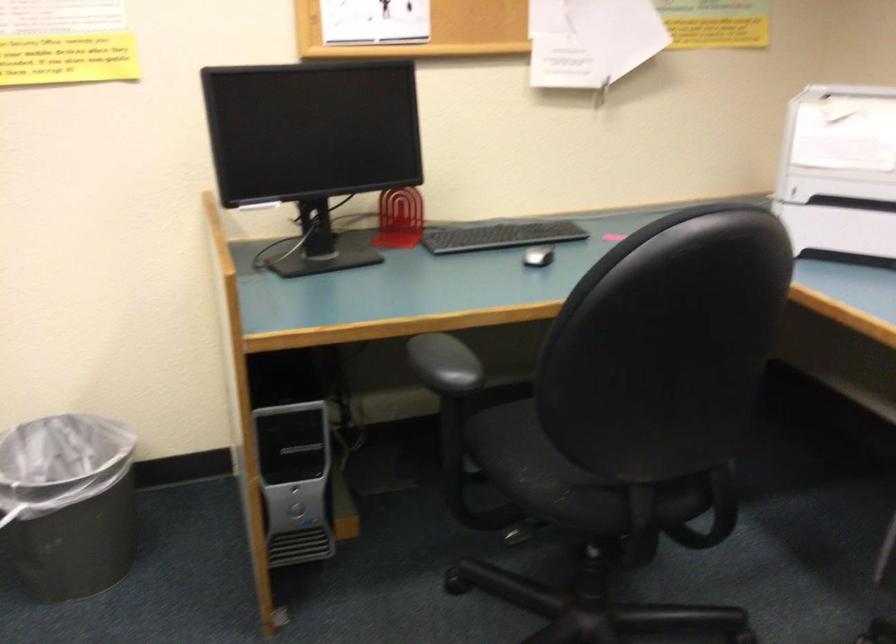
Find the location of `computer mouse`. computer mouse is located at coordinates (538, 256).